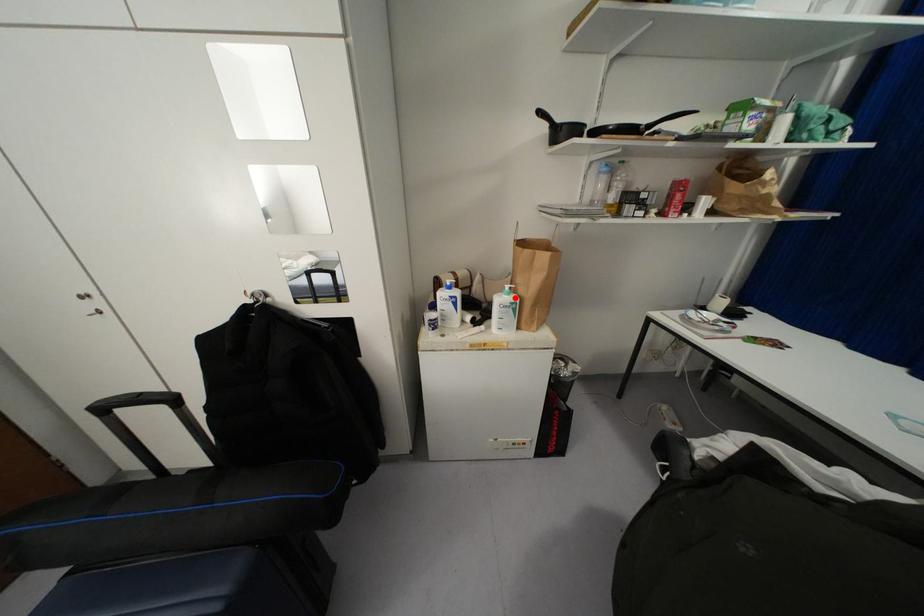
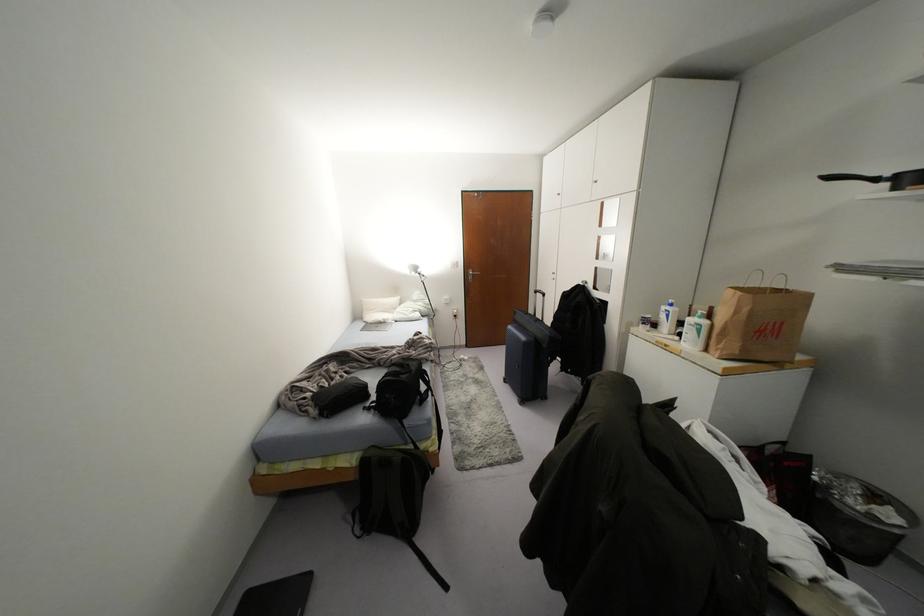
The point at the highlighted location is marked in the first image. Where is the corresponding point in the second image?

(703, 322)